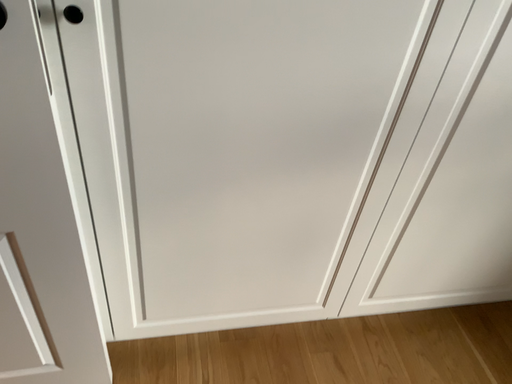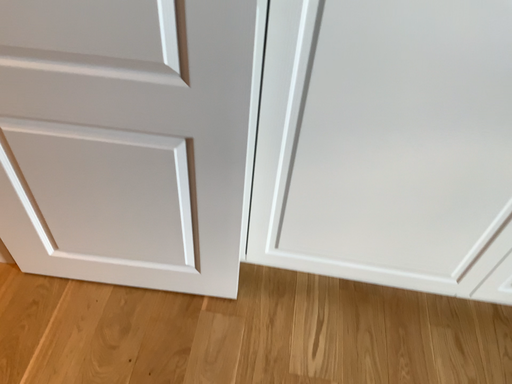
Question: How did the camera likely rotate when shooting the video?

Choices:
 (A) rotated left
 (B) rotated right

Answer: (A)